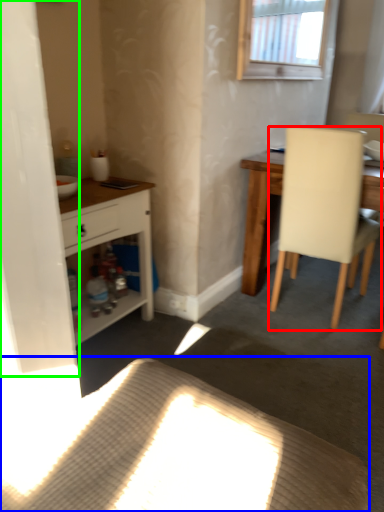
Question: Based on their relative distances, which object is farther from chair (highlighted by a red box)? Choose from plain (highlighted by a blue box) and screen door (highlighted by a green box).

Choices:
 (A) plain
 (B) screen door

Answer: (B)